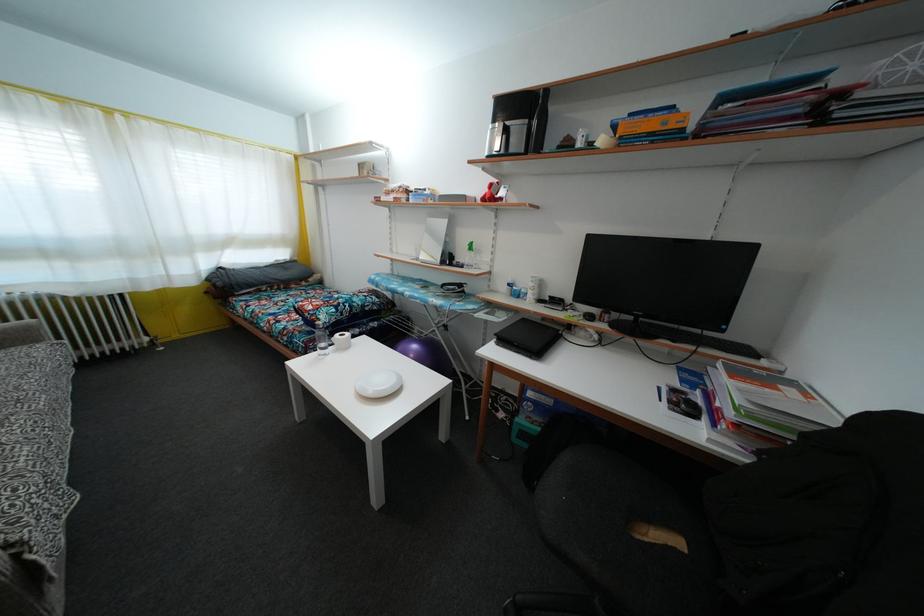
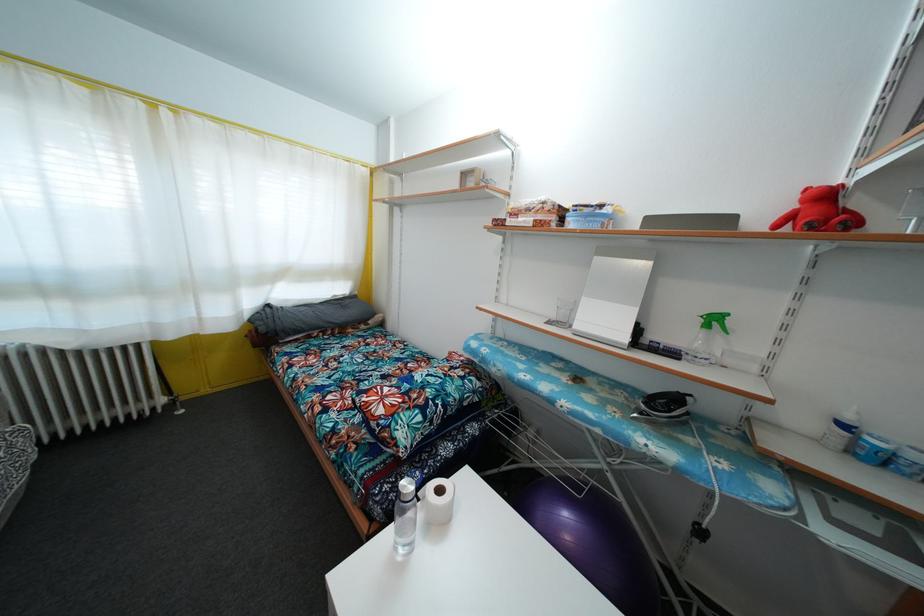
Where in the second image is the point corresponding to point 396,198 from the first image?

(531, 216)